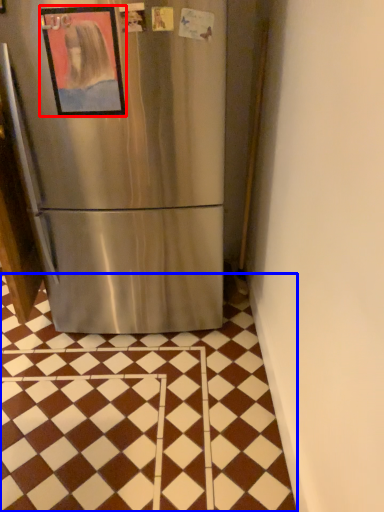
Question: Which object appears farthest to the camera in this image, picture frame (highlighted by a red box) or tile (highlighted by a blue box)?

Choices:
 (A) picture frame
 (B) tile

Answer: (A)